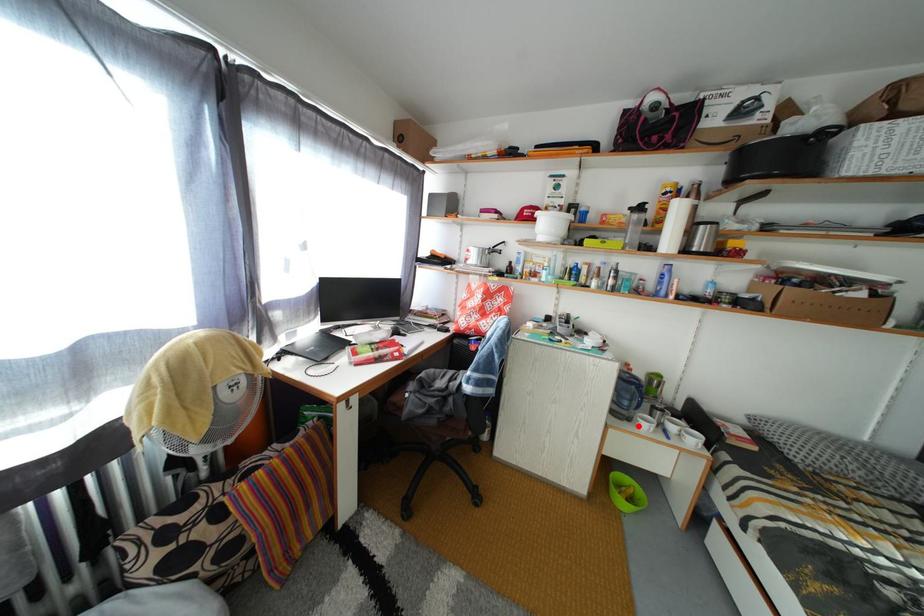
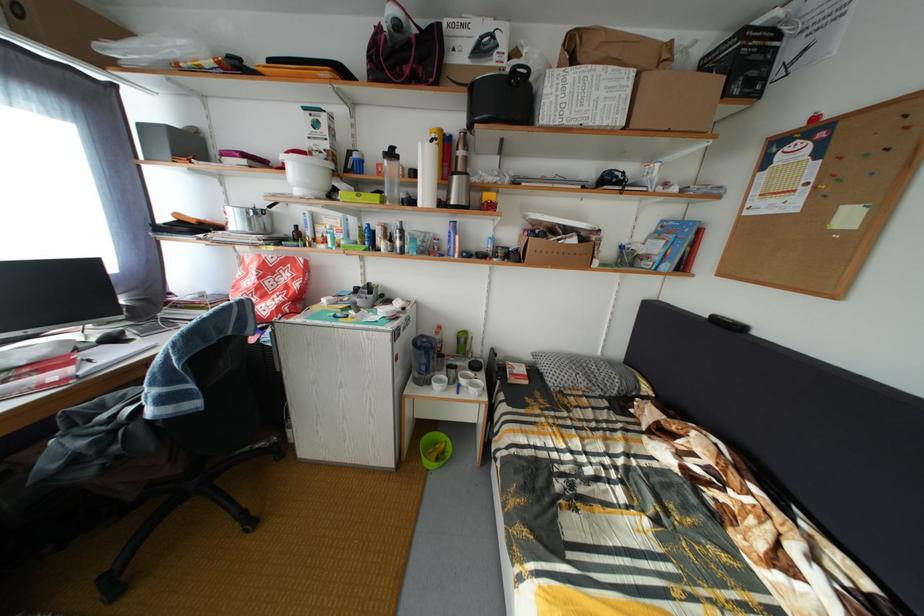
Question: I am providing you with two images of the same scene from different viewpoints. Given a red point in image1, look at the same physical point in image2. Is it:

Choices:
 (A) Closer to the viewpoint
 (B) Farther from the viewpoint

Answer: (A)